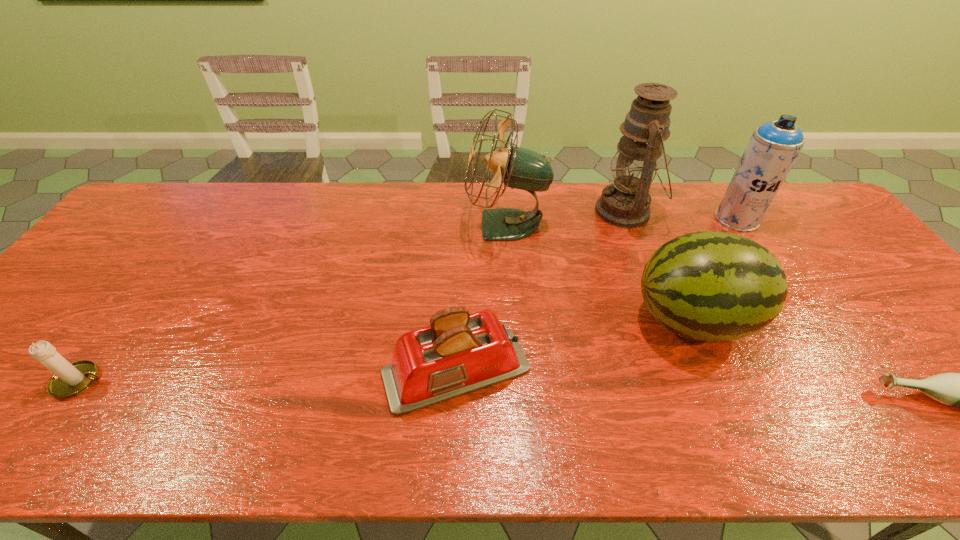
At what (x,y) coordinates should I click in order to perform the action: click on vacant region located on the front-facing side of the fan for air flow. Please return your answer as a coordinate pair (x, y). Looking at the image, I should click on (408, 226).

Where is `vacant space located 0.070m on the left of the aerosol can`? This screenshot has height=540, width=960. vacant space located 0.070m on the left of the aerosol can is located at coordinates (694, 219).

I want to click on free space located 0.380m at the stem end of the fourth shortest object, so click(481, 320).

Find the location of a particular element. Image resolution: width=960 pixels, height=540 pixels. free space located at the stem end of the fourth shortest object is located at coordinates coord(485,320).

I want to click on free space located at the stem end of the fourth shortest object, so click(595, 320).

Locate an element on the screen. free spot located 0.290m on the left of the toaster is located at coordinates (255, 371).

Where is `free spot located on the handle side of the sixth tallest object`? free spot located on the handle side of the sixth tallest object is located at coordinates (190, 381).

Identify the location of oil lamp present at the far edge. The height and width of the screenshot is (540, 960). (625, 203).

At what (x,y) coordinates should I click in order to perform the action: click on fan located at the far edge. Please return your answer as a coordinate pair (x, y). The height and width of the screenshot is (540, 960). Looking at the image, I should click on (521, 168).

Where is `aerosol can located at the far edge`? aerosol can located at the far edge is located at coordinates (774, 146).